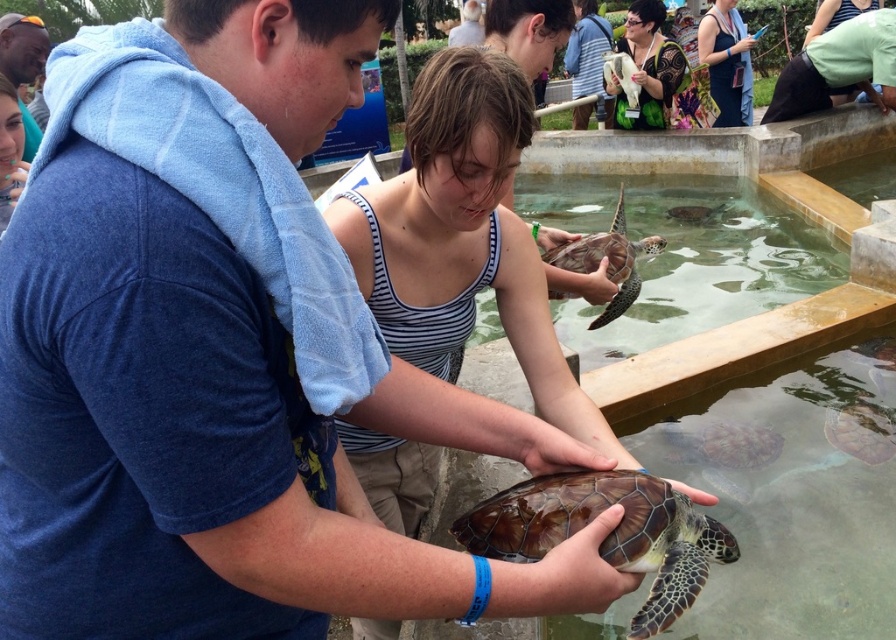
Locate an element on the screen. The image size is (896, 640). striped tank top at center is located at coordinates (463, 237).

Which is behind, point (543, 358) or point (10, 52)?

The point (10, 52) is behind.

Find the location of a particular element. striped tank top at center is located at coordinates (463, 237).

Between matte black dress at upper center and green fabric pants at lower right, which one appears on the left side from the viewer's perspective?

Positioned to the left is matte black dress at upper center.

Is matte black dress at upper center shorter than green fabric pants at lower right?

Incorrect, matte black dress at upper center's height does not fall short of green fabric pants at lower right's.

This screenshot has width=896, height=640. Describe the element at coordinates (726, 61) in the screenshot. I see `matte black dress at upper center` at that location.

Where is `matte black dress at upper center`? This screenshot has height=640, width=896. matte black dress at upper center is located at coordinates (726, 61).

Is shiny brown shell at center thinner than green fabric pants at lower right?

Yes, shiny brown shell at center is thinner than green fabric pants at lower right.

Can you confirm if shiny brown shell at center is smaller than green fabric pants at lower right?

Indeed, shiny brown shell at center has a smaller size compared to green fabric pants at lower right.

What are the coordinates of `shiny brown shell at center` in the screenshot? It's located at (607, 260).

Find the location of a particular element. The height and width of the screenshot is (640, 896). shiny brown shell at center is located at coordinates (607, 260).